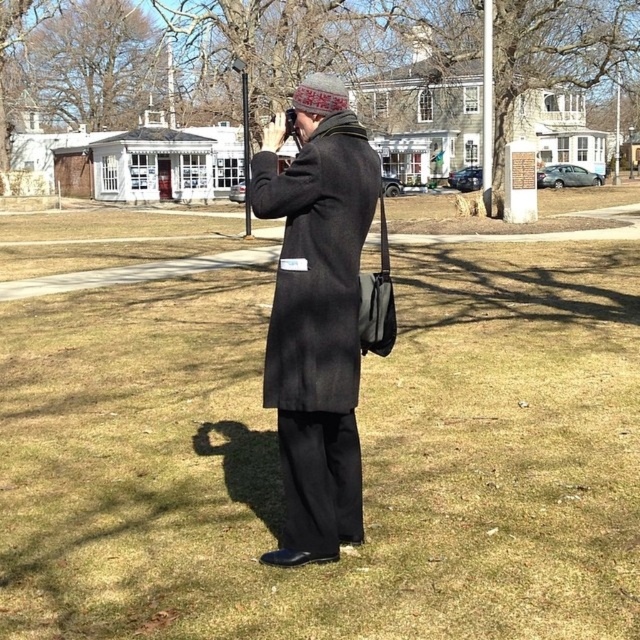
Who is taller, green grass at center or matte black coat at center?

green grass at center

Based on the photo, does green grass at center appear over matte black coat at center?

Incorrect, green grass at center is not positioned above matte black coat at center.

Where is `green grass at center`? green grass at center is located at coordinates (362, 452).